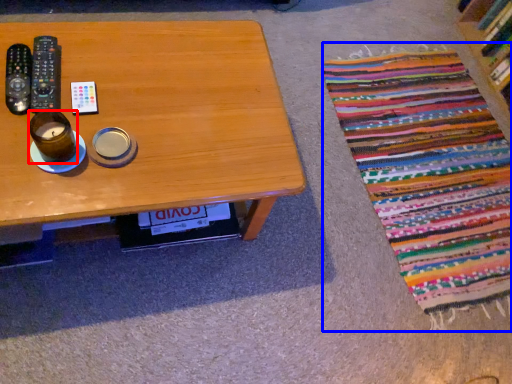
Question: Which object appears closest to the camera in this image, coffee cup (highlighted by a red box) or blanket (highlighted by a blue box)?

Choices:
 (A) coffee cup
 (B) blanket

Answer: (A)